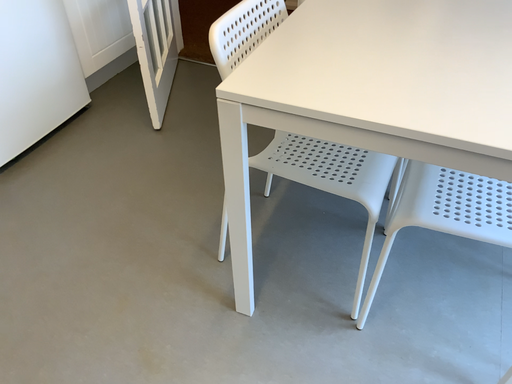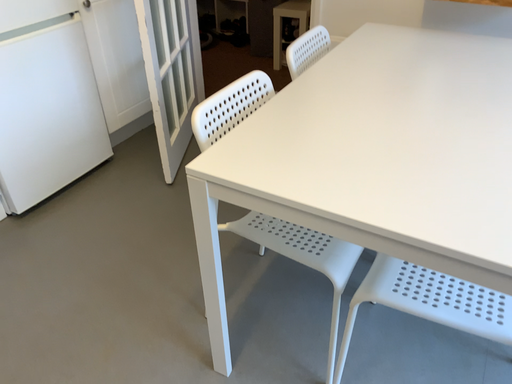
Question: How did the camera likely rotate when shooting the video?

Choices:
 (A) rotated upward
 (B) rotated downward

Answer: (A)